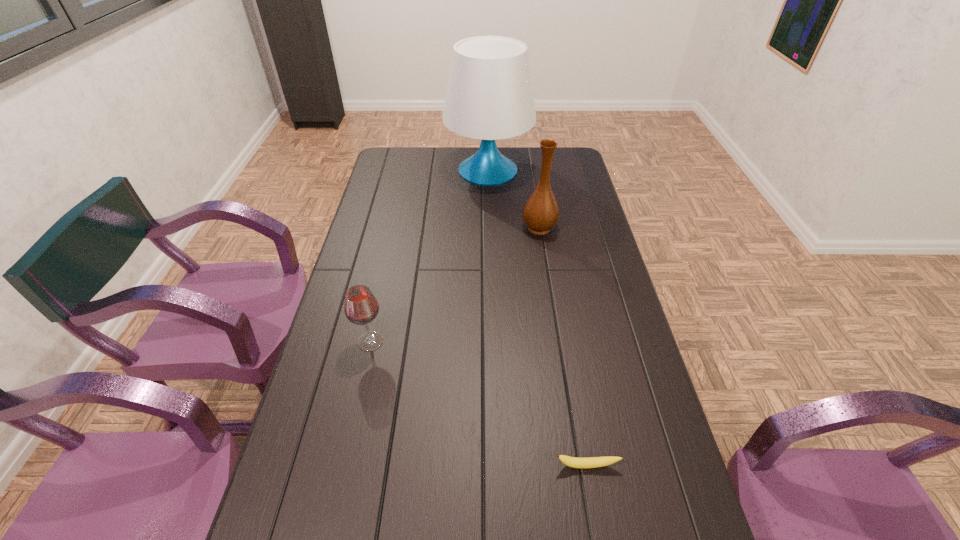
Where is `free space at the far right corner`? free space at the far right corner is located at coordinates (569, 160).

You are a GUI agent. You are given a task and a screenshot of the screen. Output one action in this format:
    pyautogui.click(x=<x>, y=<y>)
    Task: Click on the vacant area that lies between the third nearest object and the leftmost object
    This screenshot has width=960, height=540.
    Given the screenshot: What is the action you would take?
    pyautogui.click(x=455, y=285)

This screenshot has width=960, height=540. What are the coordinates of `empty space that is in between the shortest object and the tallest object` in the screenshot? It's located at (538, 318).

Image resolution: width=960 pixels, height=540 pixels. Find the location of `vacant area between the table lamp and the third tallest object`. vacant area between the table lamp and the third tallest object is located at coordinates (429, 255).

I want to click on empty space between the nearest object and the farthest object, so click(538, 318).

Where is `vacant space that is in between the nearest object and the leftmost object`? The height and width of the screenshot is (540, 960). vacant space that is in between the nearest object and the leftmost object is located at coordinates (479, 403).

Image resolution: width=960 pixels, height=540 pixels. What are the coordinates of `free space between the third shortest object and the nearest object` in the screenshot? It's located at (563, 347).

In order to click on free space between the second tallest object and the banana in this screenshot , I will do `click(563, 347)`.

The height and width of the screenshot is (540, 960). What are the coordinates of `unoccupied area between the third farthest object and the banana` in the screenshot? It's located at (479, 403).

Where is `free space that is in between the nearest object and the vase`? The image size is (960, 540). free space that is in between the nearest object and the vase is located at coordinates (563, 347).